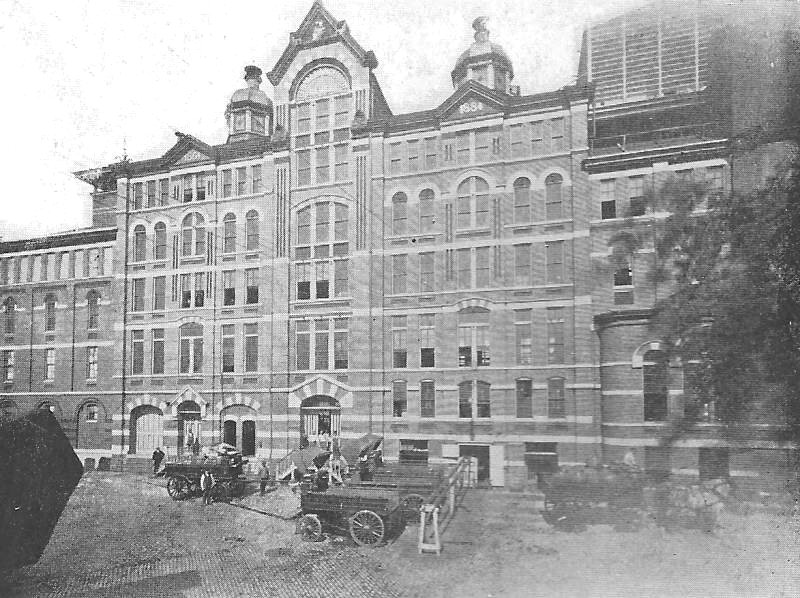
Where is `doorway`? This screenshot has width=800, height=598. doorway is located at coordinates (246, 432).